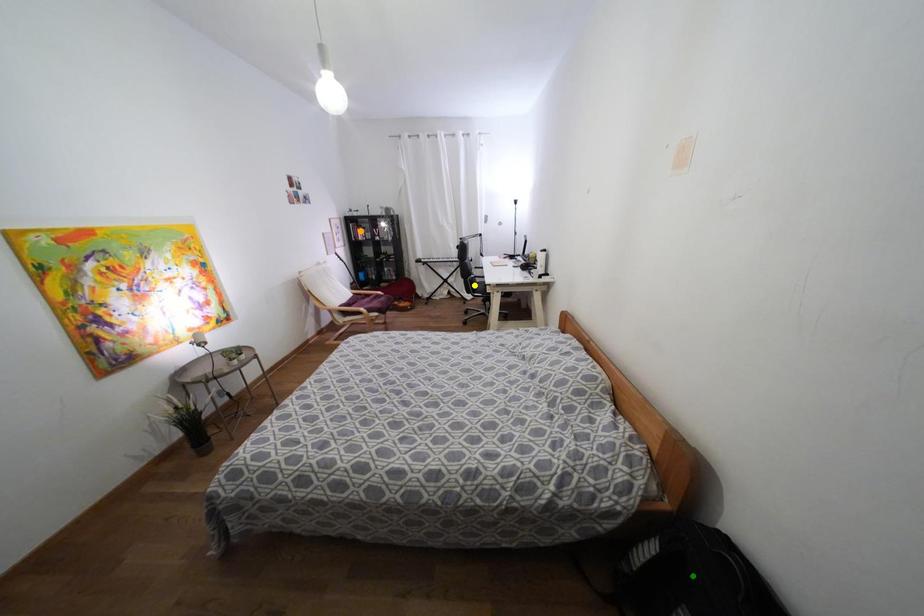
Order these from farthest to nearest:
1. orange point
2. green point
3. yellow point

orange point
yellow point
green point